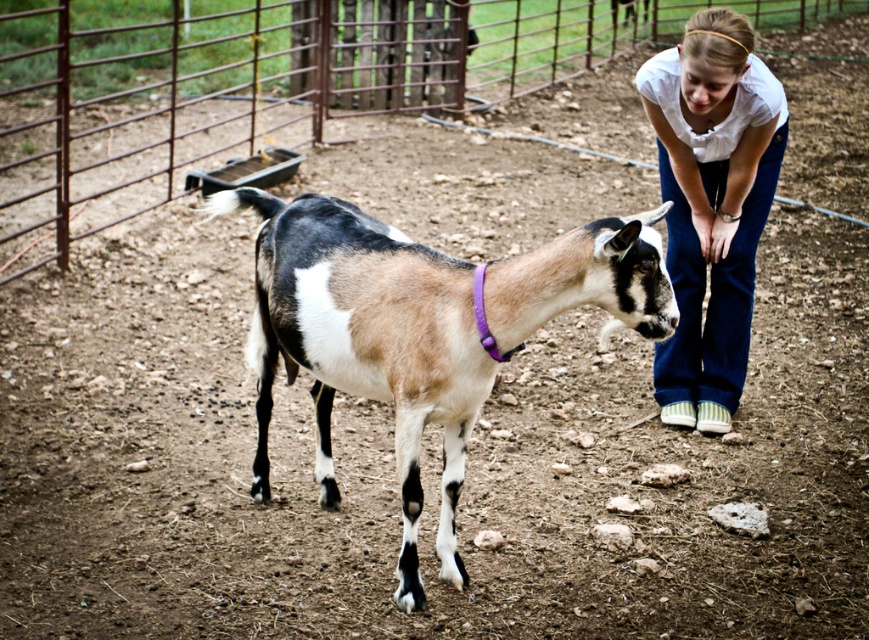
You are standing at the point marked as point (440, 304) in the image. The goat is 11.31 feet away from you. You want to give the goat a treat. Is the goat within a safe feeding distance of 10 feet? Please answer yes or no.

The distance of point (440, 304) from viewer is 11.31 feet, so the goat is 11.31 feet away from you. Since the safe feeding distance is 10 feet, the answer is no.

You are standing at the point labeled point (254, 83) in the image. What is the nearest object to you?

The nearest object to you is the brushed metal fence at center, as the point (254, 83) corresponds to its location.